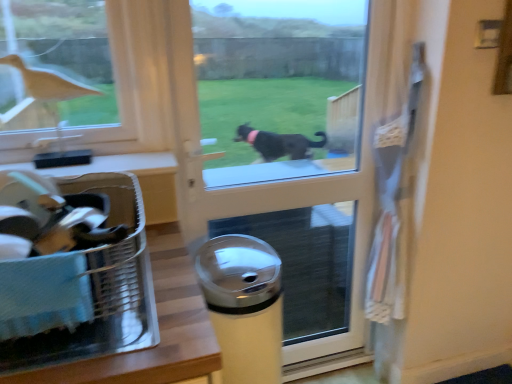
In order to face translucent plastic laundry basket at lower left, should I rotate leftwards or rightwards?

To align with it, rotate left about 23.846°.

What do you see at coordinates (283, 147) in the screenshot?
I see `transparent glass screen door at center` at bounding box center [283, 147].

Find the location of a particular element. matte brown bird at upper left is located at coordinates (52, 109).

Identify the location of translucent plastic laundry basket at lower left. Image resolution: width=512 pixels, height=384 pixels. (78, 281).

Which is further, (46, 74) or (354, 344)?

Positioned behind is point (354, 344).

Who is smaller, matte brown bird at upper left or transparent glass screen door at center?

matte brown bird at upper left.

The image size is (512, 384). I want to click on screen door behind the matte brown bird at upper left, so click(x=283, y=147).

Does matte brown bird at upper left have a greater width compared to transparent glass screen door at center?

In fact, matte brown bird at upper left might be narrower than transparent glass screen door at center.

Locate an element on the screen. screen door below the matte brown bird at upper left (from a real-world perspective) is located at coordinates (283, 147).

Considering the relative positions of transparent glass screen door at center and matte brown bird at upper left in the image provided, is transparent glass screen door at center behind matte brown bird at upper left?

Yes.

Is transparent glass screen door at center thinner than matte brown bird at upper left?

No.

Is matte brown bird at upper left located within transparent glass screen door at center?

No, matte brown bird at upper left is located outside of transparent glass screen door at center.

You are a GUI agent. You are given a task and a screenshot of the screen. Output one action in this format:
    pyautogui.click(x=<x>, y=<y>)
    Task: Click on the waste container behind the transparent glass screen door at center
    
    Given the screenshot: What is the action you would take?
    click(243, 305)

Is transparent glass screen door at center turned away from metallic silver trash can at center?

Absolutely, transparent glass screen door at center is directed away from metallic silver trash can at center.

Based on the photo, are transparent glass screen door at center and metallic silver trash can at center beside each other?

No, transparent glass screen door at center is not in contact with metallic silver trash can at center.

From a real-world perspective, which object rests below the other?

From a 3D spatial view, metallic silver trash can at center is below.

Which is more to the right, translucent plastic laundry basket at lower left or metallic silver trash can at center?

metallic silver trash can at center.

Is the surface of translucent plastic laundry basket at lower left in direct contact with metallic silver trash can at center?

translucent plastic laundry basket at lower left and metallic silver trash can at center are clearly separated.

Is translucent plastic laundry basket at lower left positioned beyond the bounds of metallic silver trash can at center?

Yes.

Looking at this image, is metallic silver trash can at center inside the boundaries of matte brown bird at upper left, or outside?

metallic silver trash can at center is spatially situated outside matte brown bird at upper left.

Is metallic silver trash can at center bigger or smaller than matte brown bird at upper left?

In the image, metallic silver trash can at center appears to be larger than matte brown bird at upper left.

From the picture: Relative to matte brown bird at upper left, is metallic silver trash can at center in front or behind?

metallic silver trash can at center is positioned farther from the viewer than matte brown bird at upper left.

Which of these two, metallic silver trash can at center or translucent plastic laundry basket at lower left, is wider?

metallic silver trash can at center is wider.

Which is correct: metallic silver trash can at center is inside translucent plastic laundry basket at lower left, or outside of it?

metallic silver trash can at center exists outside the volume of translucent plastic laundry basket at lower left.

From a real-world perspective, is metallic silver trash can at center on top of translucent plastic laundry basket at lower left?

Actually, metallic silver trash can at center is physically below translucent plastic laundry basket at lower left in the real world.

How much distance is there between metallic silver trash can at center and translucent plastic laundry basket at lower left?

metallic silver trash can at center is 19.94 inches away from translucent plastic laundry basket at lower left.

Is transparent glass screen door at center at the back of translucent plastic laundry basket at lower left?

translucent plastic laundry basket at lower left is not turned away from transparent glass screen door at center.

Looking at the image, does translucent plastic laundry basket at lower left seem bigger or smaller compared to transparent glass screen door at center?

Clearly, translucent plastic laundry basket at lower left is smaller in size than transparent glass screen door at center.

Is translucent plastic laundry basket at lower left wider than transparent glass screen door at center?

Correct, the width of translucent plastic laundry basket at lower left exceeds that of transparent glass screen door at center.

From a real-world perspective, is translucent plastic laundry basket at lower left positioned above or below transparent glass screen door at center?

Clearly, from a real-world perspective, translucent plastic laundry basket at lower left is above transparent glass screen door at center.

Locate an element on the screen. bird above the transparent glass screen door at center (from the image's perspective) is located at coordinates (52, 109).

Identify the location of screen door on the right side of matte brown bird at upper left. The height and width of the screenshot is (384, 512). (283, 147).

Based on their spatial positions, is translucent plastic laundry basket at lower left or transparent glass screen door at center further from metallic silver trash can at center?

transparent glass screen door at center is positioned further to the anchor metallic silver trash can at center.

Considering their positions, is metallic silver trash can at center positioned further to transparent glass screen door at center than translucent plastic laundry basket at lower left?

Based on the image, translucent plastic laundry basket at lower left appears to be further to transparent glass screen door at center.

Estimate the real-world distances between objects in this image. Which object is further from translucent plastic laundry basket at lower left, transparent glass screen door at center or matte brown bird at upper left?

transparent glass screen door at center is positioned further to the anchor translucent plastic laundry basket at lower left.

Which object lies nearer to the anchor point translucent plastic laundry basket at lower left, matte brown bird at upper left or transparent glass screen door at center?

Based on the image, matte brown bird at upper left appears to be nearer to translucent plastic laundry basket at lower left.

From the image, which object appears to be farther from transparent glass screen door at center, translucent plastic laundry basket at lower left or matte brown bird at upper left?

The object further to transparent glass screen door at center is translucent plastic laundry basket at lower left.

Consider the image. From the image, which object appears to be nearer to matte brown bird at upper left, translucent plastic laundry basket at lower left or metallic silver trash can at center?

The object closer to matte brown bird at upper left is translucent plastic laundry basket at lower left.

Considering their positions, is matte brown bird at upper left positioned further to transparent glass screen door at center than translucent plastic laundry basket at lower left?

Among the two, translucent plastic laundry basket at lower left is located further to transparent glass screen door at center.

Based on their spatial positions, is translucent plastic laundry basket at lower left or transparent glass screen door at center further from matte brown bird at upper left?

Among the two, transparent glass screen door at center is located further to matte brown bird at upper left.

The width and height of the screenshot is (512, 384). I want to click on laundry basket between matte brown bird at upper left and transparent glass screen door at center in the horizontal direction, so click(78, 281).

Locate an element on the screen. Image resolution: width=512 pixels, height=384 pixels. screen door between matte brown bird at upper left and metallic silver trash can at center in the up-down direction is located at coordinates (283, 147).

Image resolution: width=512 pixels, height=384 pixels. I want to click on screen door between translucent plastic laundry basket at lower left and metallic silver trash can at center in the front-back direction, so click(283, 147).

The width and height of the screenshot is (512, 384). What are the coordinates of `laundry basket between matte brown bird at upper left and metallic silver trash can at center in the up-down direction` in the screenshot? It's located at (78, 281).